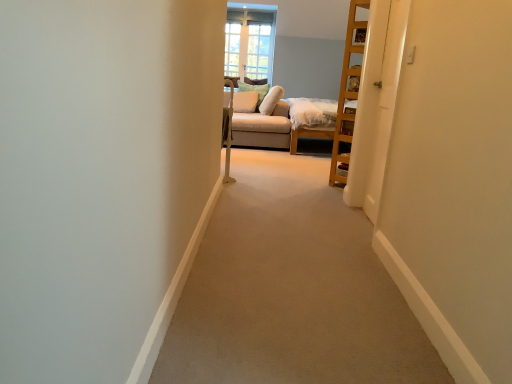
Question: Is white soft pillow at upper center, the second pillow positioned from the right, in front of or behind suede beige couch at center in the image?

Choices:
 (A) behind
 (B) front

Answer: (A)

Question: Visually, is white soft pillow at upper center, the second pillow positioned from the right, positioned to the left or to the right of suede beige couch at center?

Choices:
 (A) right
 (B) left

Answer: (B)

Question: Estimate the real-world distances between objects in this image. Which object is closer to the soft white pillow at center, which is the 1th pillow in right-to-left order?

Choices:
 (A) white fabric pillow at center, the first pillow positioned from the left
 (B) white glossy door at right
 (C) suede beige couch at center
 (D) white soft pillow at upper center, the second pillow positioned from the right
 (E) clear glass window at upper center

Answer: (C)

Question: Considering the real-world distances, which object is closest to the white fabric pillow at center, which is the third pillow from right to left?

Choices:
 (A) clear glass window at upper center
 (B) white soft pillow at upper center, the second pillow positioned from the right
 (C) soft white pillow at center, which is the 1th pillow in right-to-left order
 (D) suede beige couch at center
 (E) white glossy door at right

Answer: (B)